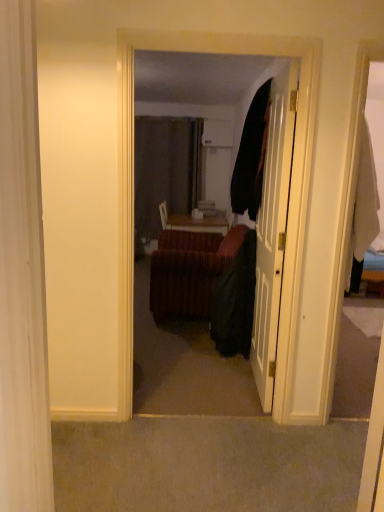
The image size is (384, 512). I want to click on velvet couch at center, so click(291, 176).

Does velvet couch at center appear on the left side of black fabric robe at center?

Yes.

Which object is wider, velvet couch at center or black fabric robe at center?

black fabric robe at center is wider.

Does velvet couch at center have a lesser height compared to black fabric robe at center?

Incorrect, the height of velvet couch at center does not fall short of that of black fabric robe at center.

Is velvet couch at center oriented away from black fabric robe at center?

Absolutely, velvet couch at center is directed away from black fabric robe at center.

Which is behind, velvet-like brown couch at center or black fabric robe at center?

Positioned behind is velvet-like brown couch at center.

Is velvet-like brown couch at center at the left side of black fabric robe at center?

Indeed, velvet-like brown couch at center is positioned on the left side of black fabric robe at center.

Consider the image. From the image's perspective, is velvet-like brown couch at center positioned above or below black fabric robe at center?

From the image's perspective, velvet-like brown couch at center appears above black fabric robe at center.

Find the location of a particular element. The width and height of the screenshot is (384, 512). studio couch behind the black fabric robe at center is located at coordinates (189, 271).

Is velvet-like brown couch at center aimed at white glossy door at center?

Yes.

From a real-world perspective, is velvet-like brown couch at center over white glossy door at center?

No, from a real-world perspective, velvet-like brown couch at center is not above white glossy door at center.

Which object is further away from the camera taking this photo, velvet-like brown couch at center or white glossy door at center?

Positioned behind is velvet-like brown couch at center.

Which object is wider, velvet-like brown couch at center or white glossy door at center?

velvet-like brown couch at center.

From a real-world perspective, which is physically below, black fabric robe at center or velvet couch at center?

black fabric robe at center.

Is black fabric robe at center oriented away from velvet couch at center?

No, black fabric robe at center is not facing away from velvet couch at center.

The height and width of the screenshot is (512, 384). What are the coordinates of `corridor in front of the black fabric robe at center` in the screenshot? It's located at (291, 176).

In the scene shown: Between velvet couch at center and velvet-like brown couch at center, which one has larger size?

With larger size is velvet-like brown couch at center.

Is velvet couch at center wider or thinner than velvet-like brown couch at center?

Clearly, velvet couch at center has less width compared to velvet-like brown couch at center.

Would you say velvet-like brown couch at center is part of velvet couch at center's contents?

No, velvet couch at center does not contain velvet-like brown couch at center.

Who is shorter, velvet couch at center or velvet-like brown couch at center?

velvet-like brown couch at center is shorter.

Do you think black fabric robe at center is within velvet-like brown couch at center, or outside of it?

black fabric robe at center cannot be found inside velvet-like brown couch at center.

How distant is black fabric robe at center from velvet-like brown couch at center?

They are 22.78 inches apart.

Is black fabric robe at center to the left of velvet-like brown couch at center from the viewer's perspective?

Incorrect, black fabric robe at center is not on the left side of velvet-like brown couch at center.

The width and height of the screenshot is (384, 512). I want to click on studio couch below the black fabric robe at center (from a real-world perspective), so click(x=189, y=271).

Is velvet-like brown couch at center oriented away from velvet couch at center?

velvet-like brown couch at center does not have its back to velvet couch at center.

Based on their sizes in the image, would you say velvet-like brown couch at center is bigger or smaller than velvet couch at center?

Considering their sizes, velvet-like brown couch at center takes up more space than velvet couch at center.

Can you tell me how much velvet-like brown couch at center and velvet couch at center differ in facing direction?

The angular difference between velvet-like brown couch at center and velvet couch at center is 0.000966 degrees.

Between velvet-like brown couch at center and velvet couch at center, which one has less height?

velvet-like brown couch at center is shorter.

At what (x,y) coordinates should I click in order to perform the action: click on corridor in front of the black fabric robe at center. Please return your answer as a coordinate pair (x, y). The height and width of the screenshot is (512, 384). Looking at the image, I should click on (291, 176).

You are a GUI agent. You are given a task and a screenshot of the screen. Output one action in this format:
    pyautogui.click(x=<x>, y=<y>)
    Task: Click on the robe on the right of velvet-like brown couch at center
    The height and width of the screenshot is (512, 384).
    Given the screenshot: What is the action you would take?
    pyautogui.click(x=235, y=301)

Considering their positions, is velvet-like brown couch at center positioned closer to black fabric robe at center than velvet couch at center?

Among the two, velvet-like brown couch at center is located nearer to black fabric robe at center.

Considering their positions, is white glossy door at center positioned further to black fabric robe at center than velvet-like brown couch at center?

velvet-like brown couch at center is positioned further to the anchor black fabric robe at center.

Based on their spatial positions, is black fabric robe at center or white glossy door at center closer to velvet-like brown couch at center?

black fabric robe at center is closer to velvet-like brown couch at center.

Considering their positions, is white glossy door at center positioned closer to velvet-like brown couch at center than black fabric robe at center?

black fabric robe at center is positioned closer to the anchor velvet-like brown couch at center.

Considering their positions, is velvet-like brown couch at center positioned further to velvet couch at center than white glossy door at center?

velvet-like brown couch at center is further to velvet couch at center.

Which object lies nearer to the anchor point white glossy door at center, black fabric robe at center or velvet-like brown couch at center?

black fabric robe at center is positioned closer to the anchor white glossy door at center.

From the image, which object appears to be farther from white glossy door at center, velvet-like brown couch at center or velvet couch at center?

velvet-like brown couch at center is positioned further to the anchor white glossy door at center.

Looking at the image, which one is located further to velvet couch at center, white glossy door at center or velvet-like brown couch at center?

velvet-like brown couch at center is positioned further to the anchor velvet couch at center.

This screenshot has width=384, height=512. Find the location of `door between velvet couch at center and black fabric robe at center from front to back`. door between velvet couch at center and black fabric robe at center from front to back is located at coordinates (273, 229).

Find the location of `door between velvet couch at center and velvet-like brown couch at center along the z-axis`. door between velvet couch at center and velvet-like brown couch at center along the z-axis is located at coordinates (273, 229).

At what (x,y) coordinates should I click in order to perform the action: click on robe located between velvet couch at center and velvet-like brown couch at center in the depth direction. Please return your answer as a coordinate pair (x, y). Looking at the image, I should click on (235, 301).

Where is `robe located between white glossy door at center and velvet-like brown couch at center in the depth direction`? robe located between white glossy door at center and velvet-like brown couch at center in the depth direction is located at coordinates (235, 301).